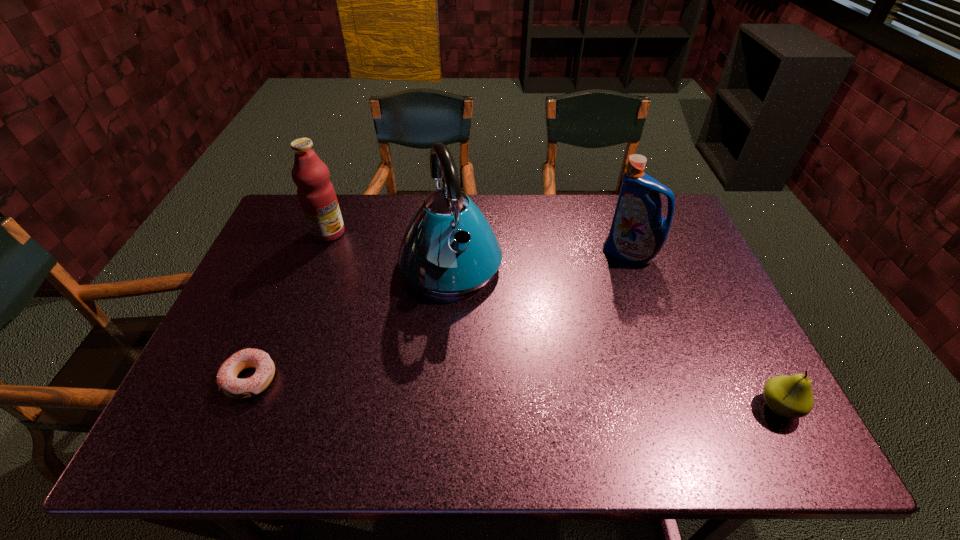
You are a GUI agent. You are given a task and a screenshot of the screen. Output one action in this format:
    pyautogui.click(x=<x>, y=<y>)
    Task: Click on the unoccupied area between the second shortest object and the fruit juice
    Image resolution: width=960 pixels, height=540 pixels.
    Given the screenshot: What is the action you would take?
    pyautogui.click(x=553, y=320)

Where is `the third closest object to the rightmost object`? The image size is (960, 540). the third closest object to the rightmost object is located at coordinates (227, 381).

Locate which object is the closest to the tallest object. Please provide its 2D coordinates. Your answer should be formatted as a tuple, i.e. [(x, y)], where the tuple contains the x and y coordinates of a point satisfying the conditions above.

[(316, 194)]

You are a GUI agent. You are given a task and a screenshot of the screen. Output one action in this format:
    pyautogui.click(x=<x>, y=<y>)
    Task: Click on the vacant space that satisfies the following two spatial constraints: 1. on the front side of the fourth tallest object; 2. on the right side of the shortest object
    This screenshot has height=540, width=960.
    Given the screenshot: What is the action you would take?
    pyautogui.click(x=238, y=407)

Find the location of a particular element. Image resolution: width=960 pixels, height=540 pixels. vacant space that satisfies the following two spatial constraints: 1. on the front side of the fruit juice; 2. on the left side of the rightmost object is located at coordinates (262, 407).